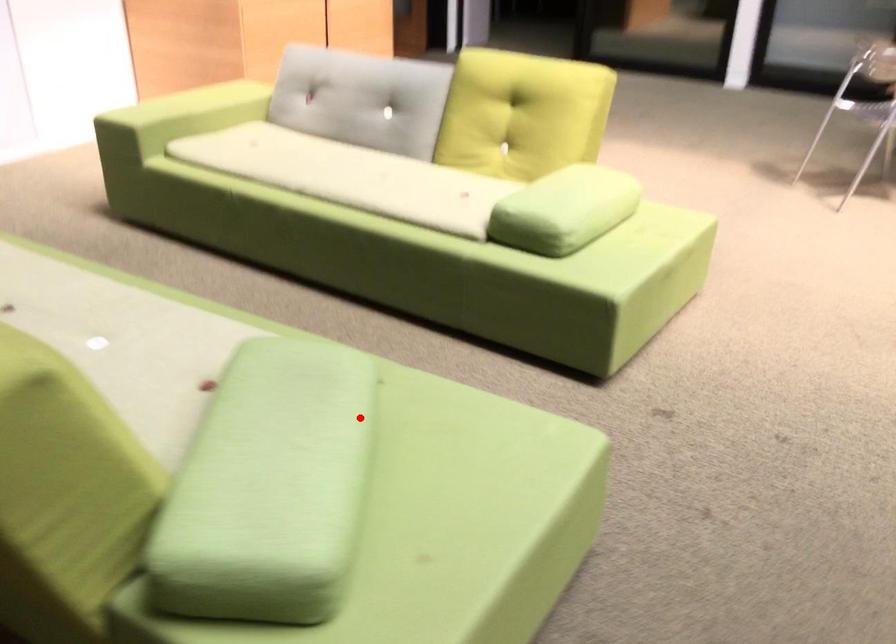
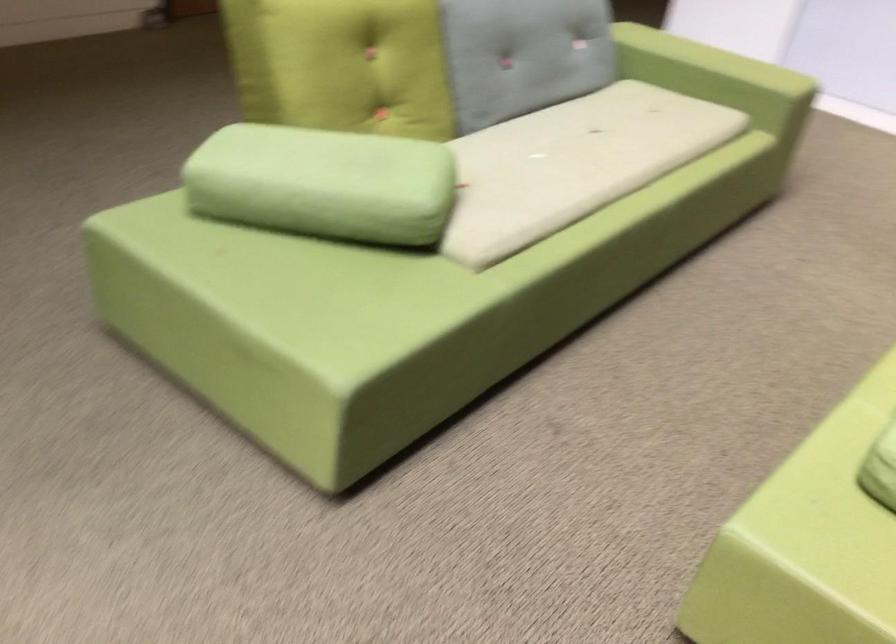
Question: I am providing you with two images of the same scene from different viewpoints. In image1, a red point is highlighted. Considering the same 3D point in image2, which of the following is correct?

Choices:
 (A) It is closer
 (B) It is farther

Answer: (B)